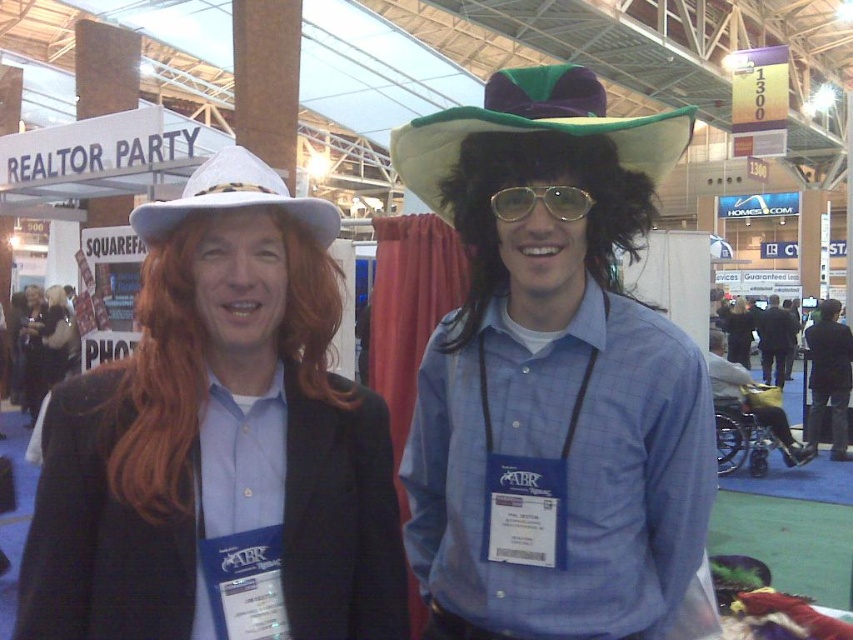
Can you confirm if black fabric jacket at lower right is wider than blue plaid shirt at center?

Incorrect, black fabric jacket at lower right's width does not surpass blue plaid shirt at center's.

Who is more forward, [839,348] or [785,328]?

Positioned in front is point [839,348].

This screenshot has width=853, height=640. What are the coordinates of `black fabric jacket at lower right` in the screenshot? It's located at (828, 378).

Locate an element on the screen. The height and width of the screenshot is (640, 853). black fabric jacket at lower right is located at coordinates (828, 378).

Who is shorter, matte blue shirt at center or black fabric jacket at lower right?

matte blue shirt at center

Does matte blue shirt at center appear on the left side of black fabric jacket at lower right?

Yes, matte blue shirt at center is to the left of black fabric jacket at lower right.

Where is `matte blue shirt at center`? This screenshot has height=640, width=853. matte blue shirt at center is located at coordinates (552, 380).

You are a GUI agent. You are given a task and a screenshot of the screen. Output one action in this format:
    pyautogui.click(x=<x>, y=<y>)
    Task: Click on the matte blue shirt at center
    The height and width of the screenshot is (640, 853).
    Given the screenshot: What is the action you would take?
    pyautogui.click(x=552, y=380)

Who is lower down, matte white hat at left or matte black jacket at center?

matte black jacket at center

Is matte white hat at left thinner than matte black jacket at center?

Yes.

Between point (213, 525) and point (51, 380), which one is positioned behind?

The point (51, 380) is more distant.

This screenshot has height=640, width=853. In order to click on matte white hat at left in this screenshot , I will do 219,442.